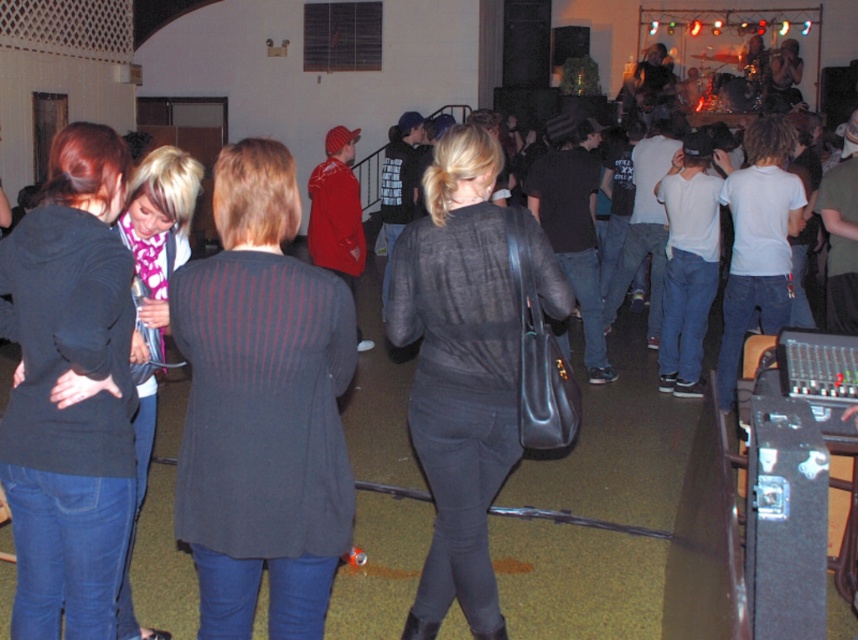
Who is more forward, (116,154) or (460,321)?

Point (116,154) is in front.

Is matte black hoodie at left taller than matte black shirt at center?

No.

Which is in front, point (82, 253) or point (572, 305)?

Point (82, 253) is more forward.

Identify the location of matte black hoodie at left. click(69, 392).

Is dark gray textured sweater at center to the left of matte black hoodie at left from the viewer's perspective?

Incorrect, dark gray textured sweater at center is not on the left side of matte black hoodie at left.

Who is more forward, (190, 339) or (61, 548)?

Point (190, 339) is more forward.

Where is `dark gray textured sweater at center`? dark gray textured sweater at center is located at coordinates (263, 406).

Who is higher up, dark gray textured sweater at center or matte black shirt at center?

Positioned higher is dark gray textured sweater at center.

Does dark gray textured sweater at center appear over matte black shirt at center?

Yes, dark gray textured sweater at center is above matte black shirt at center.

Find the location of a particular element. This screenshot has width=858, height=640. dark gray textured sweater at center is located at coordinates (263, 406).

Where is `dark gray textured sweater at center`? This screenshot has height=640, width=858. dark gray textured sweater at center is located at coordinates (263, 406).